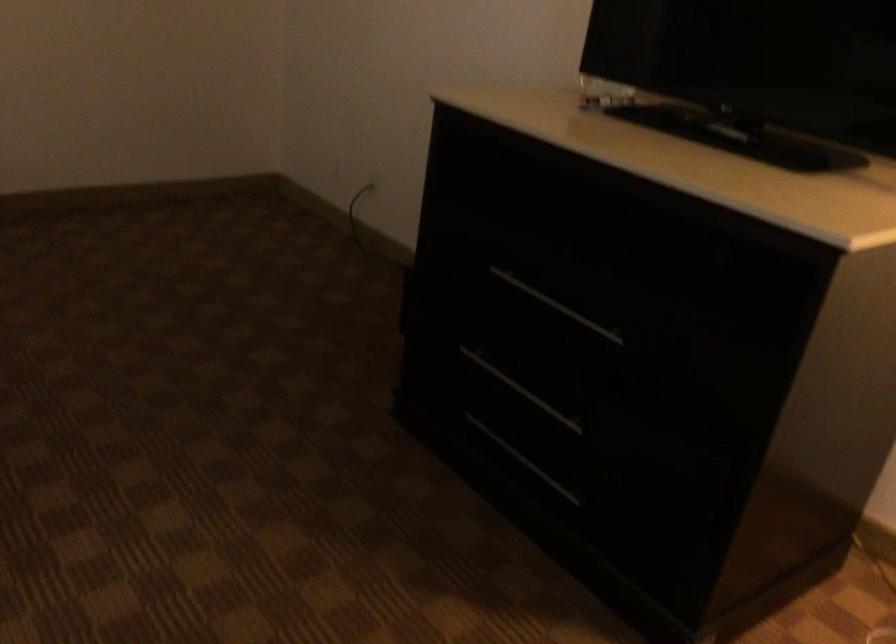
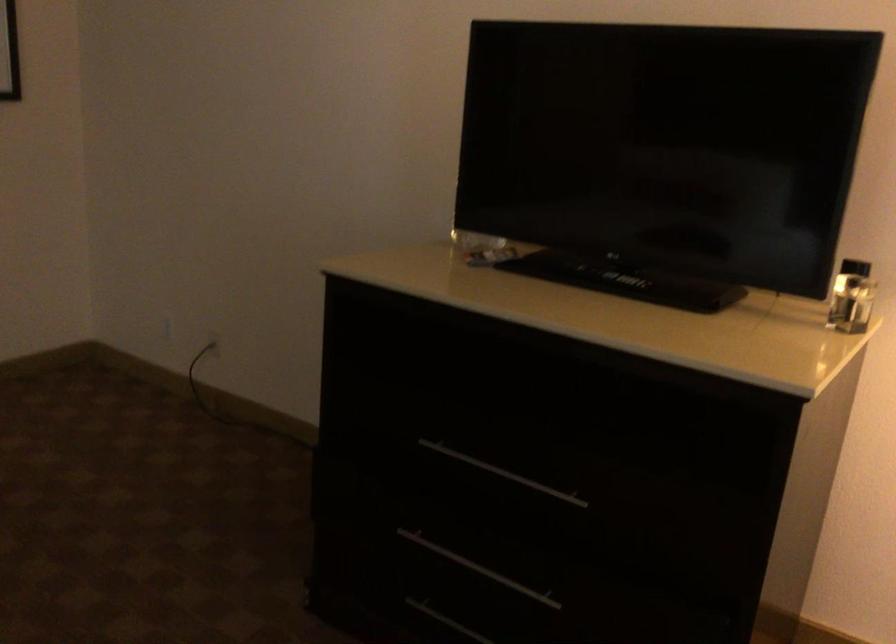
The point at (494, 438) is marked in the first image. Where is the corresponding point in the second image?

(446, 621)